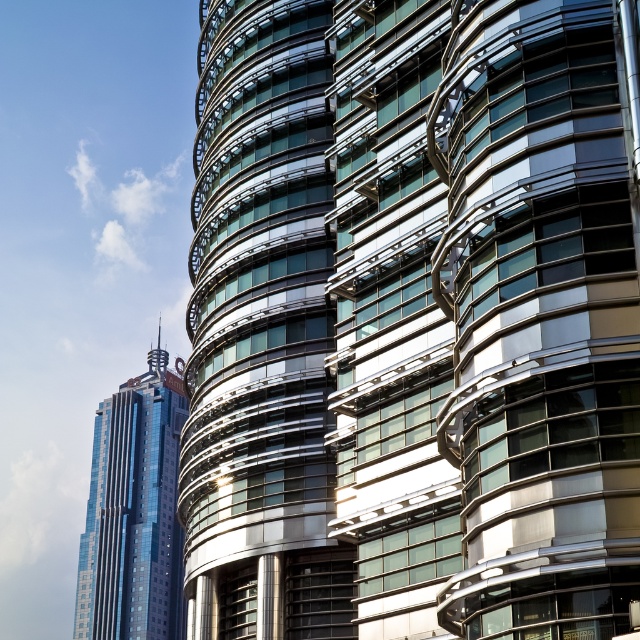
Question: From the image, what is the correct spatial relationship of glassy metallic skyscraper at center in relation to shiny blue glass skyscraper at left?

Choices:
 (A) below
 (B) above

Answer: (B)

Question: Is glassy metallic skyscraper at center further to camera compared to shiny blue glass skyscraper at left?

Choices:
 (A) no
 (B) yes

Answer: (A)

Question: Which point appears closest to the camera in this image?

Choices:
 (A) (164, 579)
 (B) (209, 42)

Answer: (B)

Question: Is glassy metallic skyscraper at center bigger than shiny blue glass skyscraper at left?

Choices:
 (A) no
 (B) yes

Answer: (A)

Question: Which point appears closest to the camera in this image?

Choices:
 (A) (588, 572)
 (B) (173, 385)

Answer: (A)